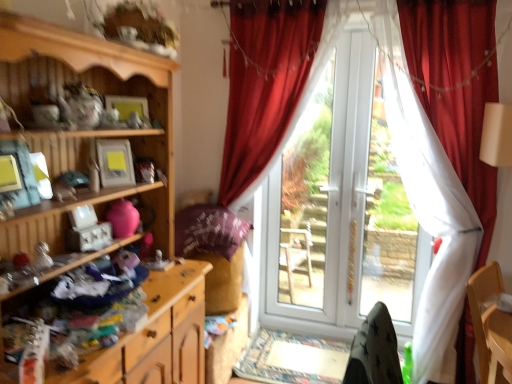
Question: Which direction should I rotate to look at white plastic door at center, which is the 1th bay window in right-to-left order?

Choices:
 (A) left
 (B) right

Answer: (B)

Question: Should I look upward or downward to see velvet red curtain at right, placed as the second curtain when sorted from left to right?

Choices:
 (A) down
 (B) up

Answer: (A)

Question: Is white plastic door at center, arranged as the first bay window when viewed from the left, not inside white glossy screen door at center?

Choices:
 (A) no
 (B) yes

Answer: (A)

Question: From a real-world perspective, is white plastic door at center, arranged as the first bay window when viewed from the left, positioned under white glossy screen door at center based on gravity?

Choices:
 (A) yes
 (B) no

Answer: (B)

Question: Are white plastic door at center, which appears as the 2th bay window when viewed from the right, and white glossy screen door at center beside each other?

Choices:
 (A) no
 (B) yes

Answer: (A)

Question: From the image's perspective, is white plastic door at center, arranged as the first bay window when viewed from the left, located beneath white glossy screen door at center?

Choices:
 (A) yes
 (B) no

Answer: (B)

Question: Does white plastic door at center, which appears as the 2th bay window when viewed from the right, come in front of white glossy screen door at center?

Choices:
 (A) yes
 (B) no

Answer: (B)

Question: Could white glossy screen door at center be considered to be inside white plastic door at center, which appears as the 2th bay window when viewed from the right?

Choices:
 (A) yes
 (B) no

Answer: (A)

Question: Does velvet red curtain at center, which ranks as the first curtain in left-to-right order, appear on the left side of wooden dresser at lower left, acting as the 1th cabinetry starting from the bottom?

Choices:
 (A) yes
 (B) no

Answer: (B)

Question: Considering the relative sizes of velvet red curtain at center, which is counted as the 2th curtain, starting from the right, and wooden dresser at lower left, which ranks as the 2th cabinetry in top-to-bottom order, in the image provided, is velvet red curtain at center, which is counted as the 2th curtain, starting from the right, bigger than wooden dresser at lower left, which ranks as the 2th cabinetry in top-to-bottom order,?

Choices:
 (A) yes
 (B) no

Answer: (A)

Question: Could wooden dresser at lower left, acting as the 1th cabinetry starting from the bottom, be considered to be inside velvet red curtain at center, which ranks as the first curtain in left-to-right order?

Choices:
 (A) yes
 (B) no

Answer: (B)

Question: From the image's perspective, is velvet red curtain at center, which is counted as the 2th curtain, starting from the right, located above wooden dresser at lower left, which ranks as the 2th cabinetry in top-to-bottom order?

Choices:
 (A) yes
 (B) no

Answer: (A)

Question: Considering the relative sizes of velvet red curtain at center, which is counted as the 2th curtain, starting from the right, and wooden dresser at lower left, which ranks as the 2th cabinetry in top-to-bottom order, in the image provided, is velvet red curtain at center, which is counted as the 2th curtain, starting from the right, shorter than wooden dresser at lower left, which ranks as the 2th cabinetry in top-to-bottom order,?

Choices:
 (A) no
 (B) yes

Answer: (A)

Question: From a real-world perspective, is velvet red curtain at center, which ranks as the first curtain in left-to-right order, positioned under wooden dresser at lower left, acting as the 1th cabinetry starting from the bottom, based on gravity?

Choices:
 (A) yes
 (B) no

Answer: (B)

Question: Is white plastic door at center, which appears as the 2th bay window when viewed from the right, behind velvet red curtain at right, the first curtain when ordered from right to left?

Choices:
 (A) no
 (B) yes

Answer: (B)